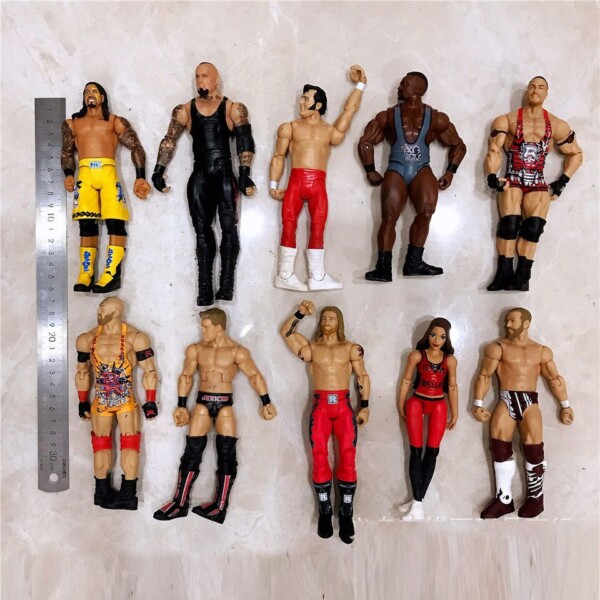
The image size is (600, 600). Identify the location of action figures. (104, 154), (216, 128), (312, 148), (420, 129), (525, 135), (531, 361), (427, 361), (337, 368), (223, 354), (116, 354).